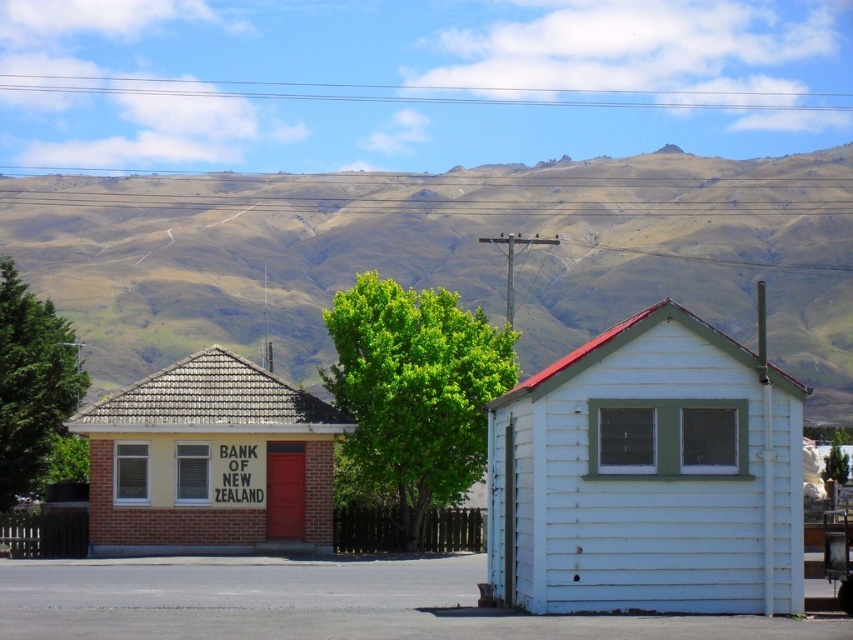
You are a drone operator trying to capture a photo of the yellow brick building at center. However, there is a brown grassy hillside at upper center in the way. Can you fly your drone over the hill to get a clear shot of the building?

The yellow brick building at center is behind the brown grassy hillside at upper center, so the drone would need to fly around the hill to capture the building without obstruction. Flying over might not be possible if the hill is too tall, but based on the description, the building is behind the hill, so positioning the drone to the side or adjusting the angle could provide a clear view.

You are a delivery person with a cart that is 1.5 meters wide. You need to deliver a package between the white wood cabin at center and the yellow brick building at center. Can your cart fit through the space between them?

The distance between the white wood cabin at center and the yellow brick building at center is 9.94 meters. Since your cart is only 1.5 meters wide, it can easily fit through the space between them.

From the picture: You are standing at the point with coordinates point (624,372) and want to walk to the point with coordinates point (231,492). Which direction should you move relative to the buildings?

Since point (624,372) is in front of point (231,492), you should move backward towards the point (231,492).